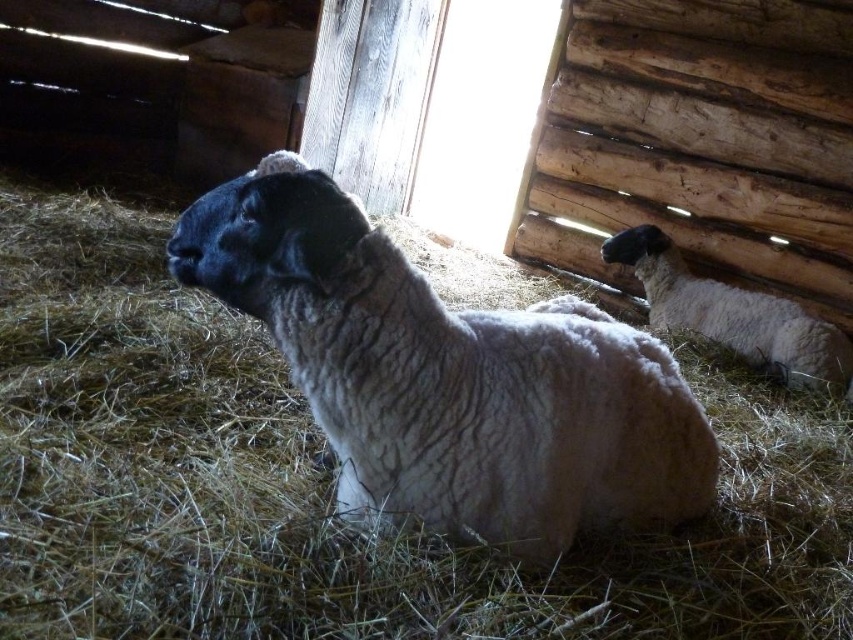
Question: Is white woolen sheep at center in front of white woolen sheep at right?

Choices:
 (A) yes
 (B) no

Answer: (A)

Question: Is white woolen sheep at center in front of white woolen sheep at right?

Choices:
 (A) no
 (B) yes

Answer: (B)

Question: Among these objects, which one is farthest from the camera?

Choices:
 (A) white woolen sheep at right
 (B) white woolen sheep at center

Answer: (A)

Question: Among these objects, which one is nearest to the camera?

Choices:
 (A) white woolen sheep at center
 (B) white woolen sheep at right

Answer: (A)

Question: Is white woolen sheep at center to the left of white woolen sheep at right from the viewer's perspective?

Choices:
 (A) yes
 (B) no

Answer: (A)